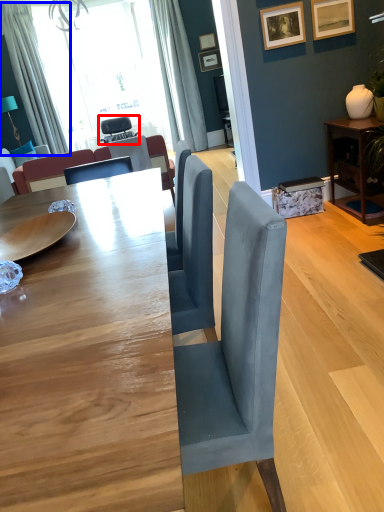
Question: Which object is closer to the camera taking this photo, chair (highlighted by a red box) or curtain (highlighted by a blue box)?

Choices:
 (A) chair
 (B) curtain

Answer: (B)